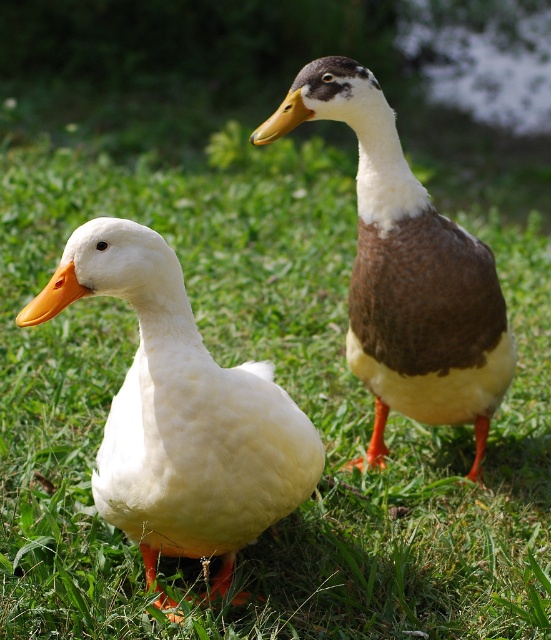
Which is more to the left, white matte duck at left or brown matte duck at upper right?

white matte duck at left

Does white matte duck at left appear on the left side of brown matte duck at upper right?

Indeed, white matte duck at left is positioned on the left side of brown matte duck at upper right.

I want to click on white matte duck at left, so click(x=181, y=413).